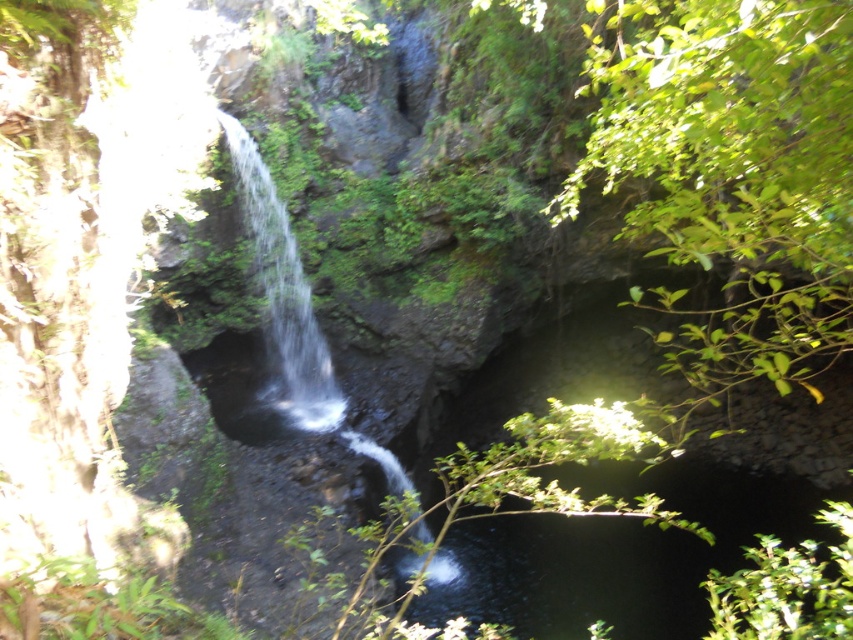
You are standing at the base of the waterfall and want to reach the two points marked in the scene. Which point, point (749, 308) or point (309, 342), is closer to you?

Point (749, 308) is further to the camera than point (309, 342), so point (309, 342) is closer to you.

You are a hiker who wants to cross from the green leafy bush at lower right to the clear water at center. Can you safely walk between them if your average step length is 0.75 meters?

The distance between the green leafy bush at lower right and the clear water at center is 7.36 meters. Since each step covers 0.75 meters, you would need approximately 10 steps to cross. This should be safe as long as there is a clear path and stable ground between them.

You are a hiker who wants to cross the clear water at center to reach the other side. There is a green leafy bush at lower right nearby. Which direction should you walk from the bush to get to the water?

The green leafy bush at lower right is positioned on the right side of clear water at center, so you should walk to the left from the bush to reach the water.